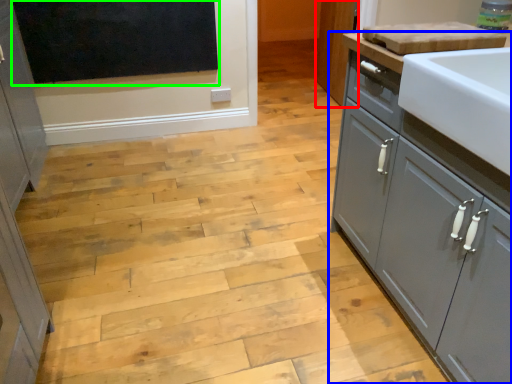
Question: Estimate the real-world distances between objects in this image. Which object is farther from cabinetry (highlighted by a red box), cupboard (highlighted by a blue box) or window screen (highlighted by a green box)?

Choices:
 (A) cupboard
 (B) window screen

Answer: (A)